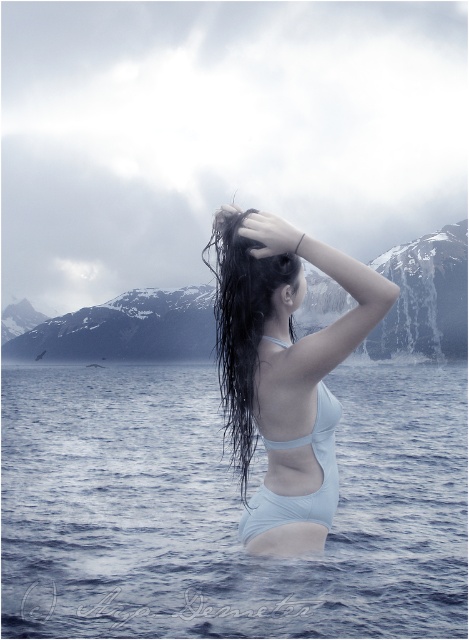
Can you confirm if blue water at center is positioned to the left of white matte swimsuit at center?

Yes, blue water at center is to the left of white matte swimsuit at center.

This screenshot has width=469, height=640. I want to click on blue water at center, so (x=225, y=508).

The height and width of the screenshot is (640, 469). In order to click on blue water at center in this screenshot , I will do `click(225, 508)`.

Does white matte bikini at center appear on the right side of white matte bikini top at upper center?

In fact, white matte bikini at center is to the left of white matte bikini top at upper center.

Can you confirm if white matte bikini at center is wider than white matte bikini top at upper center?

Yes, white matte bikini at center is wider than white matte bikini top at upper center.

Is point (325, 493) closer to camera compared to point (323, 452)?

No.

Locate an element on the screen. white matte bikini at center is located at coordinates (304, 493).

Does point (330, 618) come in front of point (219, 310)?

That is False.

The image size is (469, 640). In order to click on blue water at center in this screenshot , I will do `click(225, 508)`.

Locate an element on the screen. The image size is (469, 640). blue water at center is located at coordinates point(225,508).

This screenshot has width=469, height=640. Find the location of `blue water at center`. blue water at center is located at coordinates (225, 508).